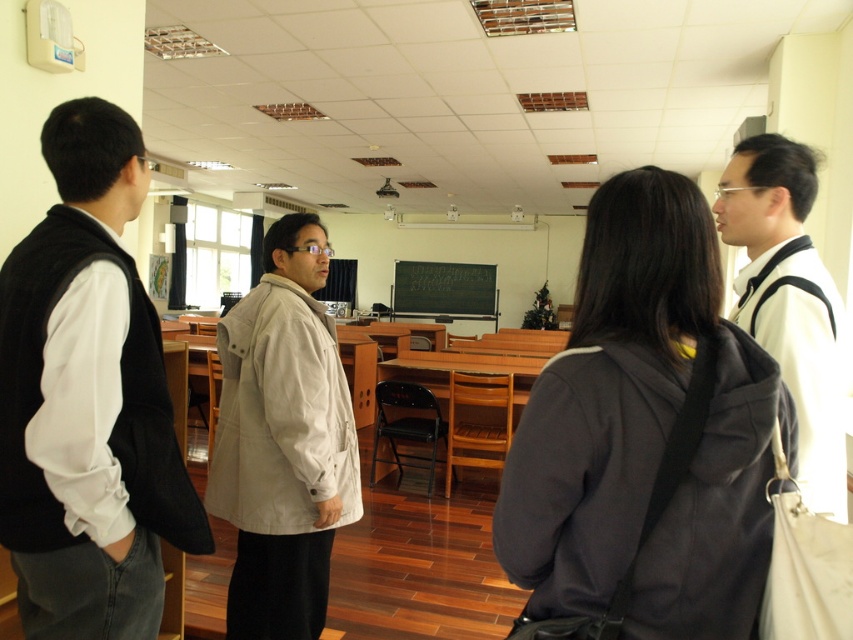
Question: Among these points, which one is farthest from the camera?

Choices:
 (A) (798, 160)
 (B) (431, 269)
 (C) (639, 538)

Answer: (B)

Question: Which object is positioned closest to the black chalkboard at center?

Choices:
 (A) dark gray fabric jacket at center
 (B) white matte jacket at right
 (C) beige fabric jacket at center

Answer: (C)

Question: Can you confirm if beige fabric jacket at center is positioned below white matte jacket at right?

Choices:
 (A) no
 (B) yes

Answer: (B)

Question: Based on their relative distances, which object is nearer to the dark gray fabric jacket at center?

Choices:
 (A) black wool vest at left
 (B) beige fabric jacket at center
 (C) white matte jacket at right
 (D) black chalkboard at center

Answer: (C)

Question: Is dark gray fabric jacket at center bigger than black chalkboard at center?

Choices:
 (A) yes
 (B) no

Answer: (B)

Question: Can you confirm if white matte jacket at right is bigger than black chalkboard at center?

Choices:
 (A) yes
 (B) no

Answer: (B)